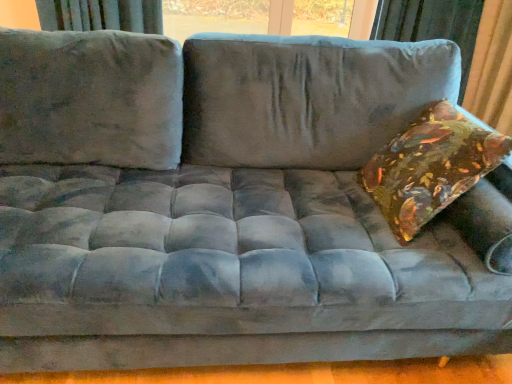
Question: In terms of width, does shiny metallic pillow at right look wider or thinner when compared to velvet curtain at upper right?

Choices:
 (A) thin
 (B) wide

Answer: (A)

Question: In terms of height, does shiny metallic pillow at right look taller or shorter compared to velvet curtain at upper right?

Choices:
 (A) short
 (B) tall

Answer: (A)

Question: Based on their sizes in the image, would you say shiny metallic pillow at right is bigger or smaller than velvet curtain at upper right?

Choices:
 (A) small
 (B) big

Answer: (A)

Question: Considering the relative positions of velvet curtain at upper right and shiny metallic pillow at right in the image provided, is velvet curtain at upper right to the left or to the right of shiny metallic pillow at right?

Choices:
 (A) left
 (B) right

Answer: (B)

Question: From the image's perspective, relative to shiny metallic pillow at right, is velvet curtain at upper right above or below?

Choices:
 (A) above
 (B) below

Answer: (A)

Question: From their relative heights in the image, would you say velvet curtain at upper right is taller or shorter than shiny metallic pillow at right?

Choices:
 (A) short
 (B) tall

Answer: (B)

Question: Would you say velvet curtain at upper right is inside or outside shiny metallic pillow at right?

Choices:
 (A) outside
 (B) inside

Answer: (A)